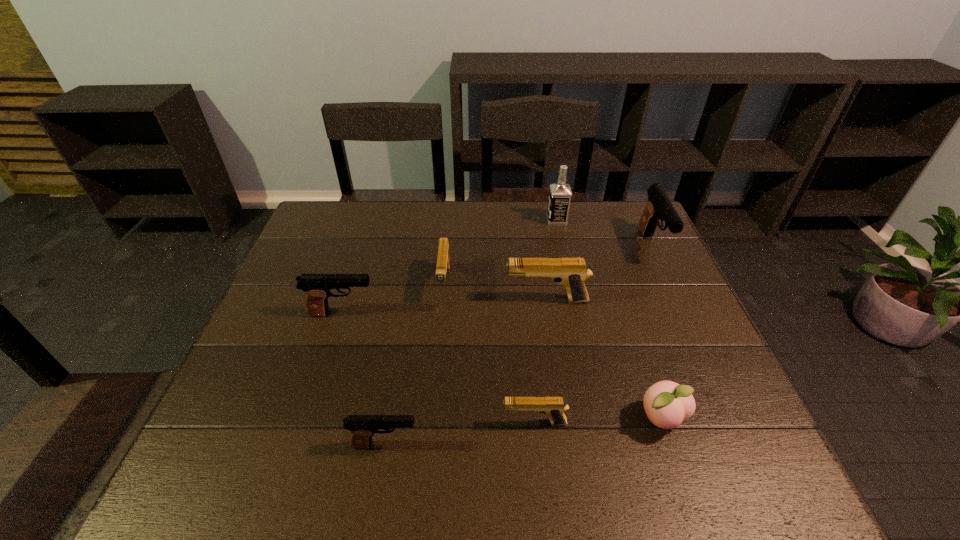
Locate an element on the screen. This screenshot has width=960, height=540. object located at the near edge is located at coordinates click(x=363, y=427).

Locate an element on the screen. This screenshot has height=540, width=960. object present at the left edge is located at coordinates (317, 287).

You are a GUI agent. You are given a task and a screenshot of the screen. Output one action in this format:
    pyautogui.click(x=<x>, y=<y>)
    Task: Click on the pistol at the right edge
    This screenshot has width=960, height=540.
    Given the screenshot: What is the action you would take?
    pyautogui.click(x=659, y=206)

This screenshot has width=960, height=540. I want to click on peach situated at the right edge, so (667, 404).

Identify the location of object that is at the far right corner. The height and width of the screenshot is (540, 960). (659, 206).

Where is `vacant position at the far edge of the desktop`? This screenshot has width=960, height=540. vacant position at the far edge of the desktop is located at coordinates (493, 228).

In the image, there is a desktop. Where is `vacant area at the near edge`? This screenshot has width=960, height=540. vacant area at the near edge is located at coordinates (673, 461).

Locate an element on the screen. The width and height of the screenshot is (960, 540). vacant area at the left edge of the desktop is located at coordinates (275, 325).

In order to click on vacant space at the right edge of the desktop in this screenshot , I will do `click(658, 376)`.

Where is `vacant area at the far left corner of the desktop`? vacant area at the far left corner of the desktop is located at coordinates (348, 204).